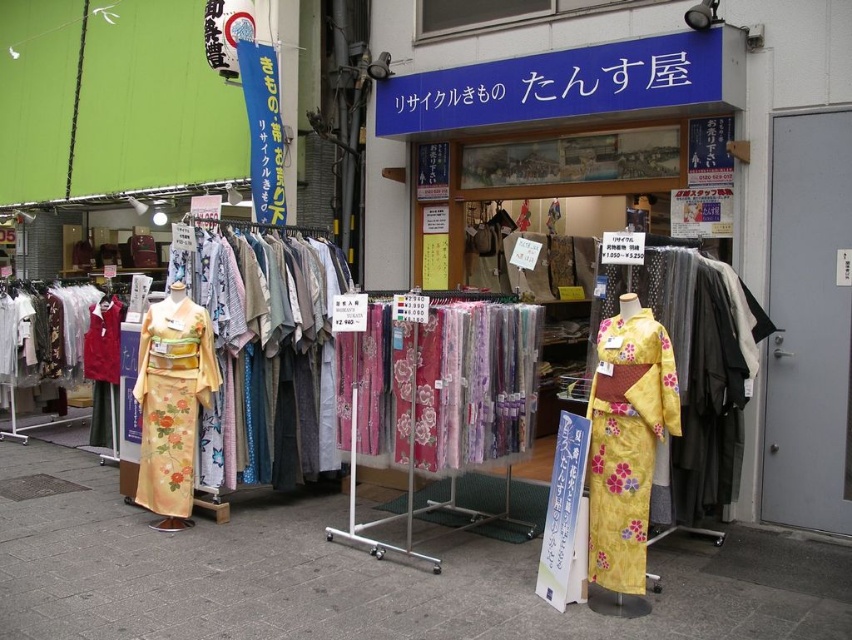
You are a customer standing in front of the shop and want to step onto the floral silk kimono at center. Can you walk directly to it from the matte concrete pavement at center without moving any objects?

The matte concrete pavement at center is positioned on the left side of floral silk kimono at center, so you can walk directly to the floral silk kimono at center from the matte concrete pavement at center as they are adjacent.

You are a customer standing in front of the shop and want to step onto the matte concrete pavement at center to get a closer look at the yellow floral kimono at center. Is the pavement to the left or right of the kimono?

The matte concrete pavement at center is to the left of the yellow floral kimono at center, so you should move to the left side of the kimono to step onto the pavement.